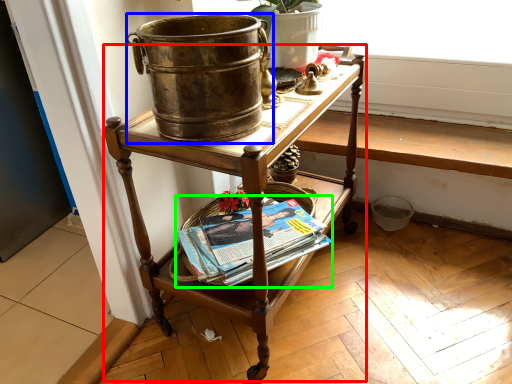
Question: Based on their relative distances, which object is nearer to desk (highlighted by a red box)? Choose from flowerpot (highlighted by a blue box) and paperback book (highlighted by a green box).

Choices:
 (A) flowerpot
 (B) paperback book

Answer: (B)